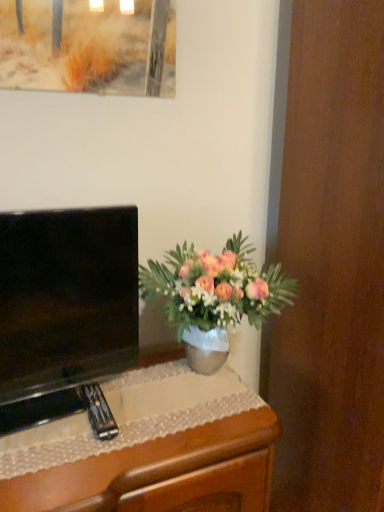
Locate an element on the screen. wooden desk at lower left is located at coordinates (149, 450).

This screenshot has height=512, width=384. Describe the element at coordinates (64, 309) in the screenshot. I see `black glossy television at left` at that location.

Locate an element on the screen. This screenshot has height=512, width=384. wooden desk at lower left is located at coordinates (149, 450).

Do you think black glossy television at left is within wooden desk at lower left, or outside of it?

black glossy television at left lies outside wooden desk at lower left.

Would you say black glossy television at left is a long distance from wooden desk at lower left?

black glossy television at left is near wooden desk at lower left, not far away.

Can you tell me how much black glossy television at left and wooden desk at lower left differ in facing direction?

The angular difference between black glossy television at left and wooden desk at lower left is 6.45 degrees.

Which object is closer to the camera taking this photo, black glossy television at left or wooden desk at lower left?

wooden desk at lower left is in front.

Identify the location of houseplant that is above the wooden desk at lower left (from the image's perspective). (214, 296).

From a real-world perspective, relative to wooden desk at lower left, is pink matte vase at center vertically above or below?

pink matte vase at center is above wooden desk at lower left.

Measure the distance between pink matte vase at center and wooden desk at lower left.

pink matte vase at center is 10.09 inches away from wooden desk at lower left.

In terms of width, does pink matte vase at center look wider or thinner when compared to wooden desk at lower left?

In the image, pink matte vase at center appears to be more narrow than wooden desk at lower left.

In the scene shown: Is pink matte vase at center outside of black glossy television at left?

That's correct, pink matte vase at center is outside of black glossy television at left.

Can you confirm if pink matte vase at center is positioned to the right of black glossy television at left?

Correct, you'll find pink matte vase at center to the right of black glossy television at left.

At what (x,y) coordinates should I click in order to perform the action: click on television above the pink matte vase at center (from the image's perspective). Please return your answer as a coordinate pair (x, y). Looking at the image, I should click on pyautogui.click(x=64, y=309).

Is pink matte vase at center with black glossy television at left?

No, pink matte vase at center is not touching black glossy television at left.

Considering the relative sizes of wooden desk at lower left and pink matte vase at center in the image provided, is wooden desk at lower left wider than pink matte vase at center?

Yes.

The width and height of the screenshot is (384, 512). What are the coordinates of `houseplant lying above the wooden desk at lower left (from the image's perspective)` in the screenshot? It's located at (214, 296).

Choose the correct answer: Is wooden desk at lower left inside pink matte vase at center or outside it?

wooden desk at lower left is not inside pink matte vase at center, it's outside.

What's the angular difference between wooden desk at lower left and pink matte vase at center's facing directions?

0.182 degrees.

Is black glossy television at left surrounded by wooden desk at lower left?

No, black glossy television at left is not a part of wooden desk at lower left.

Which is nearer, (x=180, y=464) or (x=102, y=322)?

The point (x=180, y=464) is closer to the camera.

From a real-world perspective, is wooden desk at lower left physically below black glossy television at left?

Indeed, from a real-world perspective, wooden desk at lower left is positioned beneath black glossy television at left.

Does wooden desk at lower left have a smaller size compared to black glossy television at left?

No.

Is black glossy television at left in contact with pink matte vase at center?

black glossy television at left is not next to pink matte vase at center, and they're not touching.

Which of these two, black glossy television at left or pink matte vase at center, is thinner?

With smaller width is black glossy television at left.

From the image's perspective, is black glossy television at left below pink matte vase at center?

Actually, black glossy television at left appears above pink matte vase at center in the image.

In the scene shown: Choose the correct answer: Is black glossy television at left inside pink matte vase at center or outside it?

black glossy television at left is not enclosed by pink matte vase at center.

The height and width of the screenshot is (512, 384). Identify the location of television above the wooden desk at lower left (from a real-world perspective). (64, 309).

Identify the location of desk lying below the pink matte vase at center (from the image's perspective). tap(149, 450).

Looking at the image, which one is located closer to wooden desk at lower left, black glossy television at left or pink matte vase at center?

black glossy television at left lies closer to wooden desk at lower left than the other object.

Which object lies nearer to the anchor point pink matte vase at center, wooden desk at lower left or black glossy television at left?

Among the two, black glossy television at left is located nearer to pink matte vase at center.

Consider the image. Which object lies nearer to the anchor point pink matte vase at center, black glossy television at left or wooden desk at lower left?

Based on the image, black glossy television at left appears to be nearer to pink matte vase at center.

In the scene shown: Based on their spatial positions, is pink matte vase at center or black glossy television at left further from wooden desk at lower left?

pink matte vase at center.

Looking at the image, which one is located further to black glossy television at left, wooden desk at lower left or pink matte vase at center?

pink matte vase at center.

Estimate the real-world distances between objects in this image. Which object is closer to black glossy television at left, pink matte vase at center or wooden desk at lower left?

The object closer to black glossy television at left is wooden desk at lower left.

Identify the location of houseplant between black glossy television at left and wooden desk at lower left from top to bottom. (214, 296).